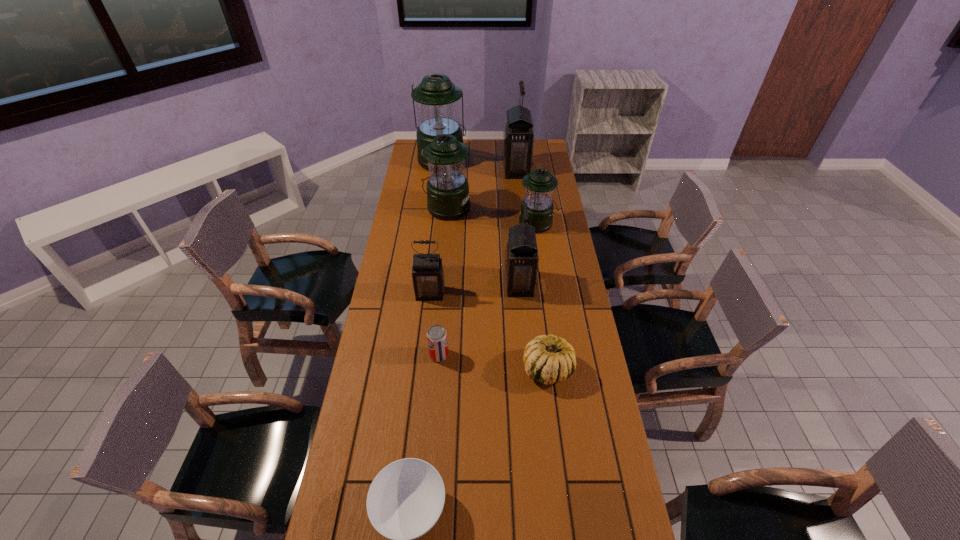
Identify the location of blank region between the second smallest green lantern and the leftmost gray lantern. This screenshot has height=540, width=960. (439, 251).

Find the location of a particular element. empty space that is in between the second smallest gray lantern and the soda is located at coordinates (479, 320).

You are a GUI agent. You are given a task and a screenshot of the screen. Output one action in this format:
    pyautogui.click(x=<x>, y=<y>)
    Task: Click on the eighth closest object to the white gourd
    The width and height of the screenshot is (960, 540).
    Given the screenshot: What is the action you would take?
    pyautogui.click(x=436, y=97)

At what (x,y) coordinates should I click in order to perform the action: click on object that is the third closest to the smallest green lantern. Please return your answer as a coordinate pair (x, y). This screenshot has width=960, height=540. Looking at the image, I should click on (518, 138).

Identify which lantern is the second closest to the farthest green lantern. Please provide its 2D coordinates. Your answer should be formatted as a tuple, i.e. [(x, y)], where the tuple contains the x and y coordinates of a point satisfying the conditions above.

[(447, 192)]

Where is `lantern that is the fifth closest to the leftmost gray lantern`? lantern that is the fifth closest to the leftmost gray lantern is located at coordinates (436, 97).

Find the location of a particular element. green lantern that is the closest to the rightmost green lantern is located at coordinates (447, 192).

What are the coordinates of `green lantern identified as the third closest to the soda` in the screenshot? It's located at (436, 97).

Image resolution: width=960 pixels, height=540 pixels. I want to click on gray lantern that stands as the closest to the leftmost gray lantern, so click(x=521, y=254).

What are the coordinates of `gray lantern that is the third closest to the biggest green lantern` in the screenshot? It's located at (428, 279).